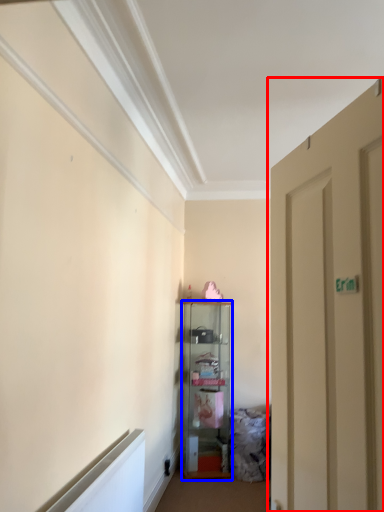
Question: Which object appears farthest to the camera in this image, door (highlighted by a red box) or cabinetry (highlighted by a blue box)?

Choices:
 (A) door
 (B) cabinetry

Answer: (B)